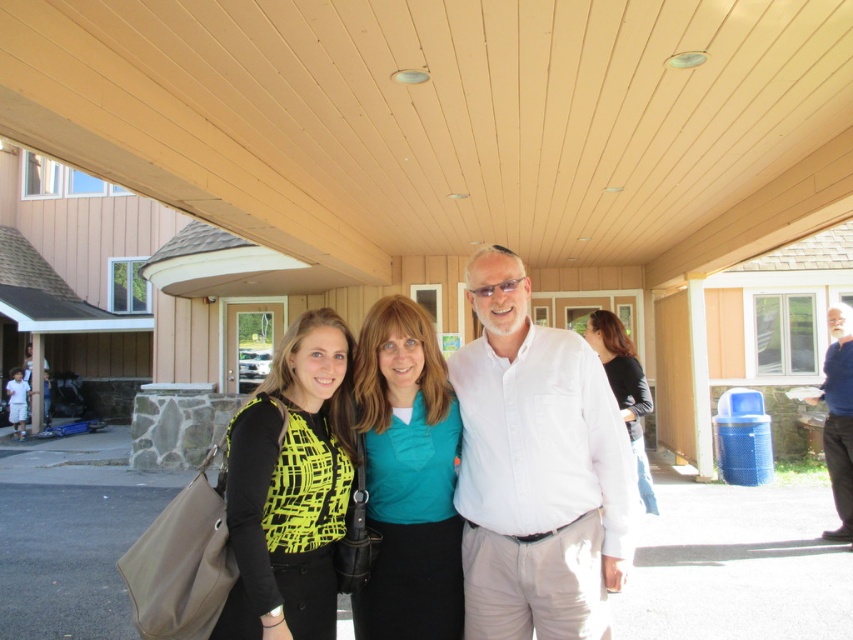
Question: Which of the following is the closest to the observer?

Choices:
 (A) (631, 419)
 (B) (521, 550)
 (C) (590, 557)

Answer: (B)

Question: Among these points, which one is farthest from the camera?

Choices:
 (A) (589, 342)
 (B) (436, 483)
 (C) (845, 380)
 (D) (262, 577)

Answer: (C)

Question: Which object is farther from the camera taking this photo?

Choices:
 (A) white cotton shirt at center
 (B) neon green fabric shirt at center

Answer: (B)

Question: Does neon green fabric shirt at center have a smaller size compared to teal fabric shirt at center?

Choices:
 (A) no
 (B) yes

Answer: (A)

Question: Is teal fabric shirt at center smaller than black jersey at center?

Choices:
 (A) yes
 (B) no

Answer: (A)

Question: Is neon yellow printed top at center smaller than blue cotton shirt at right?

Choices:
 (A) no
 (B) yes

Answer: (B)